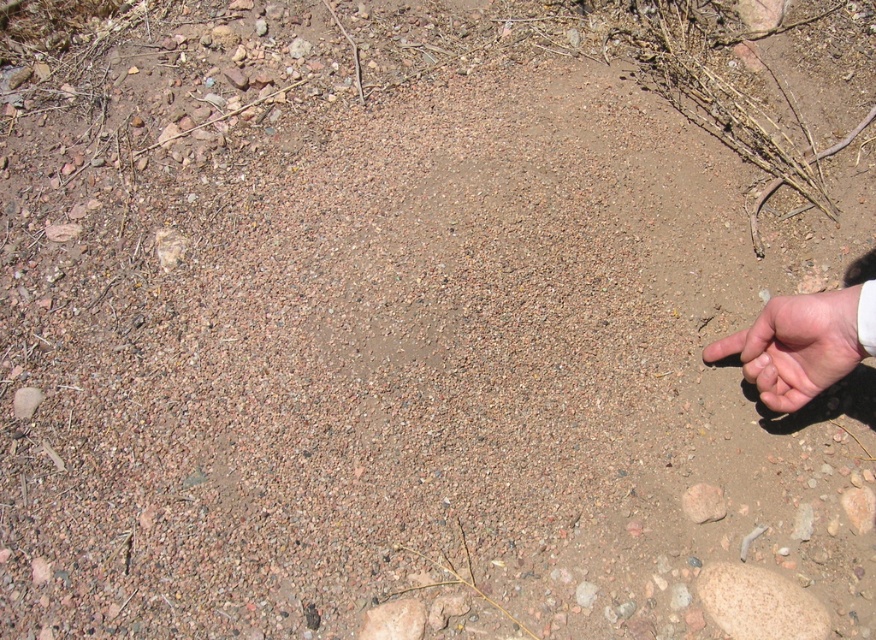
Is the position of skinny white hand at lower right less distant than that of brown rough stone at center?

Yes, skinny white hand at lower right is in front of brown rough stone at center.

Which is below, skinny white hand at lower right or brown rough stone at center?

brown rough stone at center

This screenshot has height=640, width=876. What do you see at coordinates (796, 346) in the screenshot?
I see `skinny white hand at lower right` at bounding box center [796, 346].

You are a GUI agent. You are given a task and a screenshot of the screen. Output one action in this format:
    pyautogui.click(x=<x>, y=<y>)
    Task: Click on the skinny white hand at lower right
    Image resolution: width=876 pixels, height=640 pixels.
    Given the screenshot: What is the action you would take?
    [x=796, y=346]